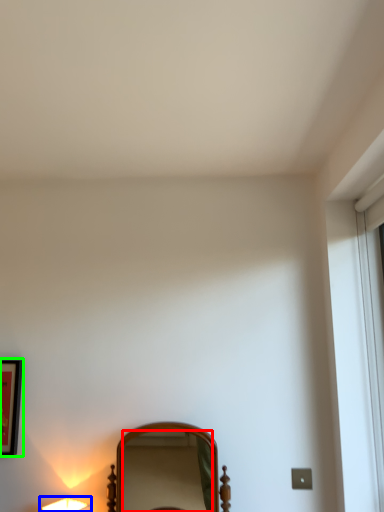
Question: Based on their relative distances, which object is nearer to mirror (highlighted by a red box)? Choose from lamp (highlighted by a blue box) and picture frame (highlighted by a green box).

Choices:
 (A) lamp
 (B) picture frame

Answer: (B)